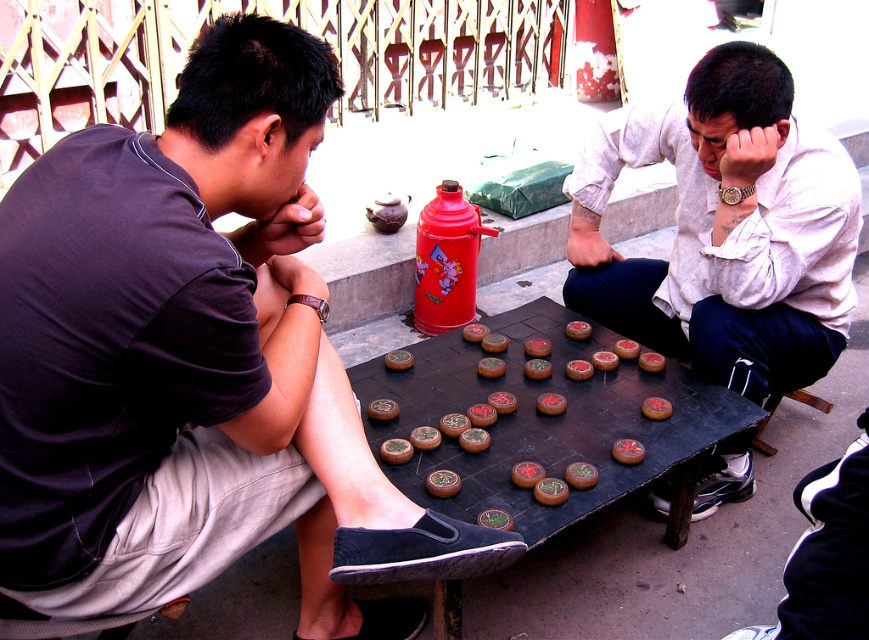
Does point (219, 211) lie behind point (786, 211)?

No, it is in front of (786, 211).

Can you confirm if matte black shirt at left is positioned below matte white shirt at center?

Correct, matte black shirt at left is located below matte white shirt at center.

At what (x,y) coordinates should I click in order to perform the action: click on matte black shirt at left. Please return your answer as a coordinate pair (x, y). The height and width of the screenshot is (640, 869). Looking at the image, I should click on (196, 364).

Locate an element on the screen. The width and height of the screenshot is (869, 640). matte black shirt at left is located at coordinates (196, 364).